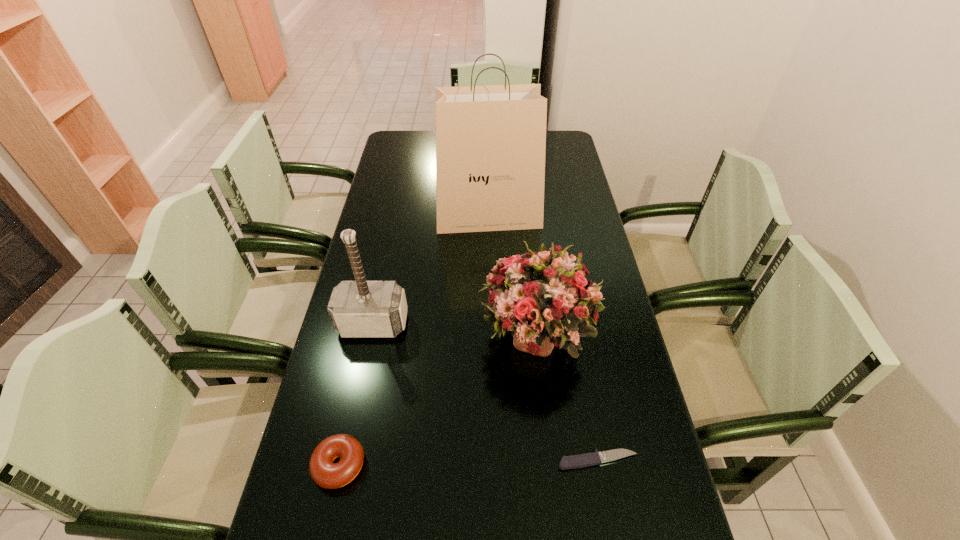
Identify the location of vacant space located on the back of the shortest object. (577, 347).

The image size is (960, 540). In order to click on hammer present at the left edge in this screenshot , I will do `click(360, 308)`.

Locate an element on the screen. This screenshot has width=960, height=540. doughnut that is at the left edge is located at coordinates (325, 473).

Locate an element on the screen. The height and width of the screenshot is (540, 960). bouquet located in the right edge section of the desktop is located at coordinates (543, 298).

Identify the location of steak knife that is at the right edge. (588, 459).

The image size is (960, 540). I want to click on vacant region at the left edge of the desktop, so click(x=393, y=190).

In the image, there is a desktop. Where is `vacant space at the right edge`? The height and width of the screenshot is (540, 960). vacant space at the right edge is located at coordinates (552, 168).

Find the location of a particular element. free point at the far left corner is located at coordinates (404, 131).

Find the location of `free spot between the shopping bag and the hammer`. free spot between the shopping bag and the hammer is located at coordinates (431, 270).

This screenshot has width=960, height=540. I want to click on free space between the fourth tallest object and the shopping bag, so click(x=414, y=341).